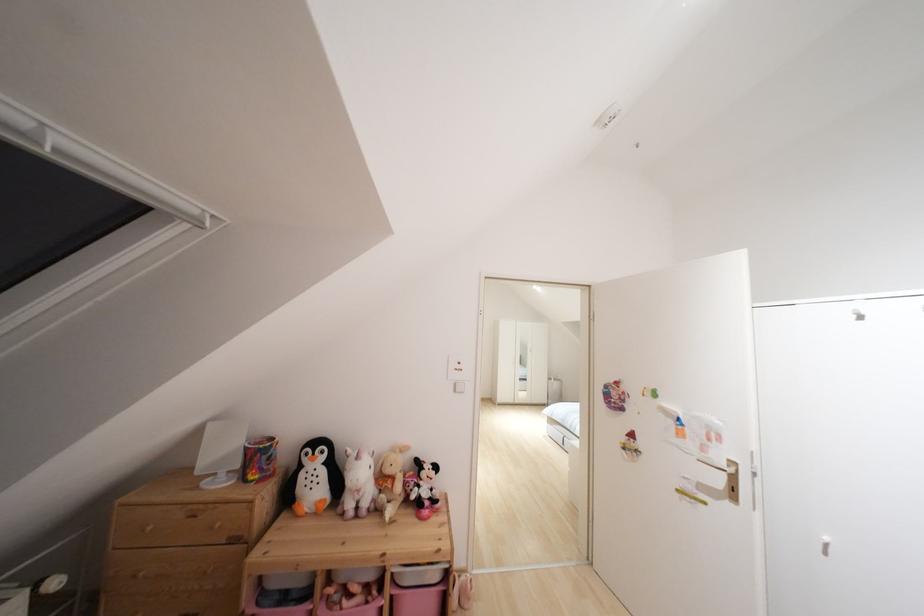
What do you see at coordinates (457, 387) in the screenshot? I see `a white light switch` at bounding box center [457, 387].